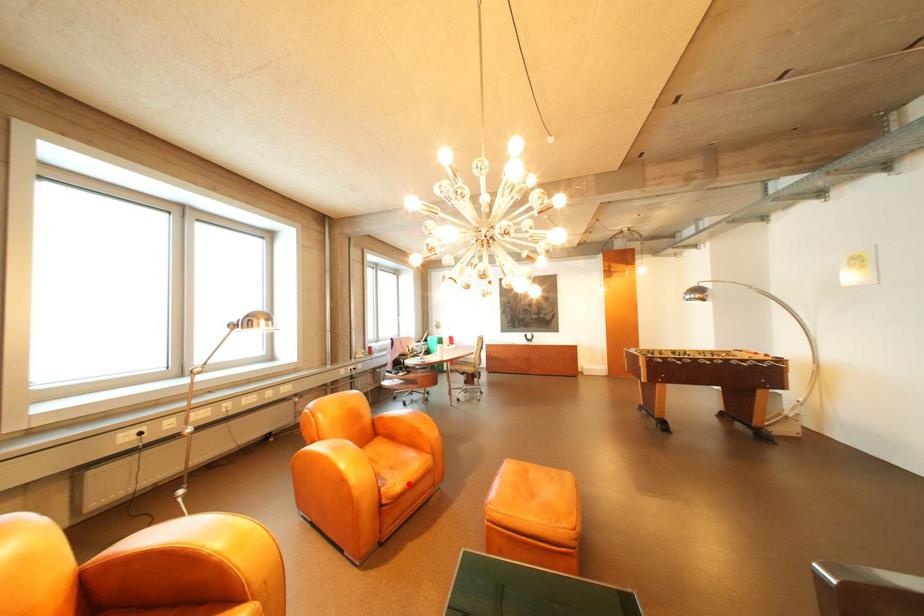
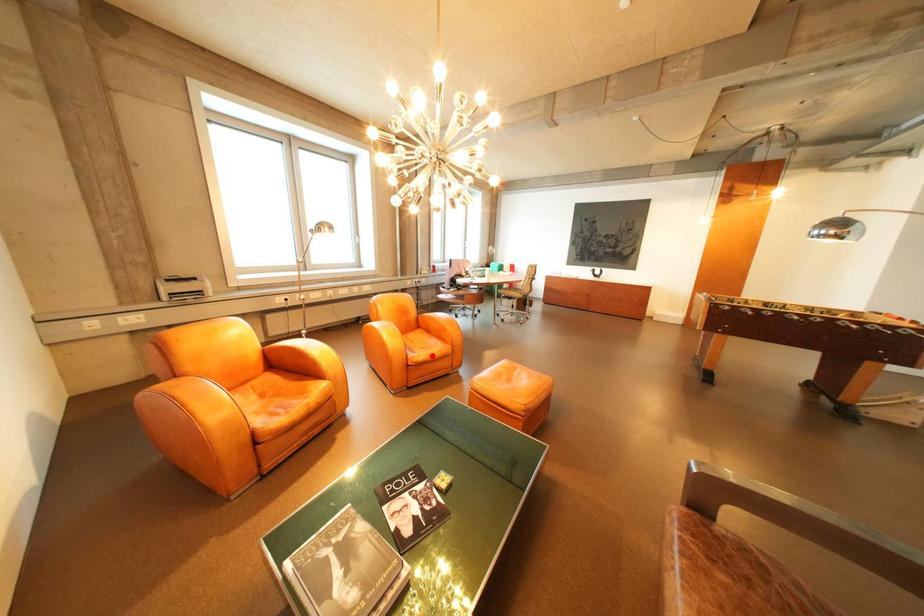
I am providing you with two images of the same scene from different viewpoints. A red point is marked on the first image and another point is marked on the second image. Does the point marked in image1 correspond to the same location as the one in image2?

Yes